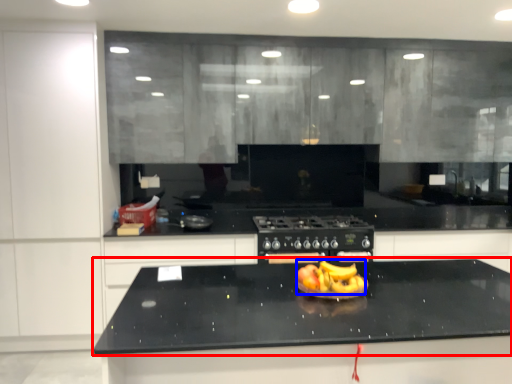
Question: Among these objects, which one is nearest to the camera, countertop (highlighted by a red box) or fruit dish (highlighted by a blue box)?

Choices:
 (A) countertop
 (B) fruit dish

Answer: (A)